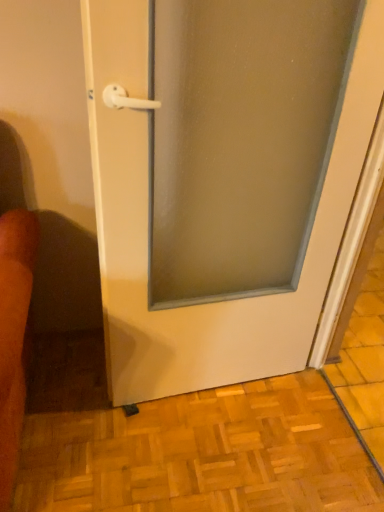
Question: From the image's perspective, relative to white glossy door at center, is wooden parquet floor at lower center above or below?

Choices:
 (A) below
 (B) above

Answer: (A)

Question: Considering their positions, is wooden parquet floor at lower center located in front of or behind white glossy door at center?

Choices:
 (A) front
 (B) behind

Answer: (B)

Question: From a real-world perspective, is wooden parquet floor at lower center above or below white glossy door at center?

Choices:
 (A) above
 (B) below

Answer: (B)

Question: Is white glossy door at center wider or thinner than wooden parquet floor at lower center?

Choices:
 (A) thin
 (B) wide

Answer: (A)

Question: From the image's perspective, is white glossy door at center above or below wooden parquet floor at lower center?

Choices:
 (A) below
 (B) above

Answer: (B)

Question: Is white glossy door at center bigger or smaller than wooden parquet floor at lower center?

Choices:
 (A) small
 (B) big

Answer: (B)

Question: Which is correct: white glossy door at center is inside wooden parquet floor at lower center, or outside of it?

Choices:
 (A) outside
 (B) inside

Answer: (A)